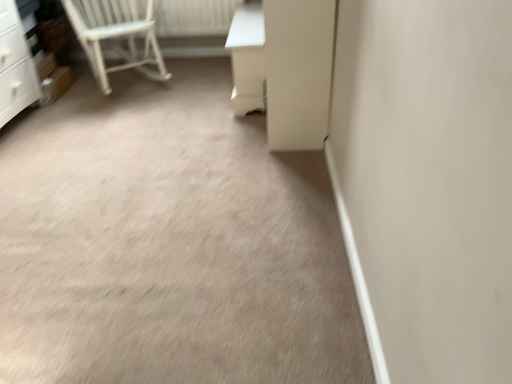
Question: Considering the positions of point (239, 76) and point (320, 64), is point (239, 76) closer or farther from the camera than point (320, 64)?

Choices:
 (A) farther
 (B) closer

Answer: (A)

Question: In the image, is white glossy vanity at upper right positioned in front of or behind white glossy screen door at center?

Choices:
 (A) front
 (B) behind

Answer: (B)

Question: Which is farther from the white glossy screen door at center?

Choices:
 (A) white glossy vanity at upper right
 (B) beige carpet at center
 (C) white painted wood radiator at upper left
 (D) white wooden chair at upper left

Answer: (C)

Question: Estimate the real-world distances between objects in this image. Which object is farther from the white glossy vanity at upper right?

Choices:
 (A) beige carpet at center
 (B) white wooden chair at upper left
 (C) white glossy screen door at center
 (D) white painted wood radiator at upper left

Answer: (B)